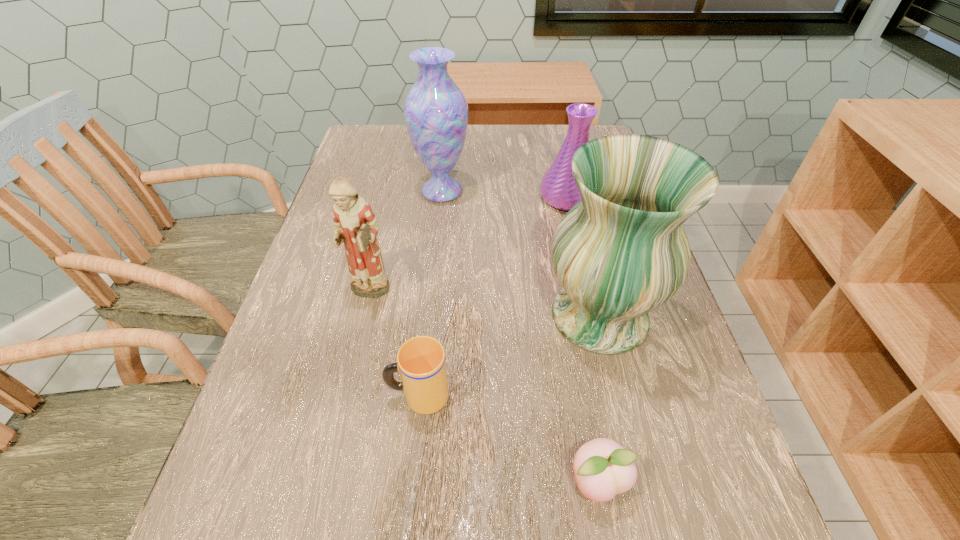
Find the location of `vacant area at the far left corner of the desktop`. vacant area at the far left corner of the desktop is located at coordinates (352, 160).

The width and height of the screenshot is (960, 540). I want to click on vacant point located between the second nearest object and the figurine, so click(394, 345).

Where is `vacant area that lies between the second shortest object and the nearest object`? This screenshot has width=960, height=540. vacant area that lies between the second shortest object and the nearest object is located at coordinates (508, 439).

Identify the location of free space between the nearest vase and the cup. The width and height of the screenshot is (960, 540). (509, 356).

I want to click on vacant region between the figurine and the shortest vase, so click(x=468, y=246).

This screenshot has width=960, height=540. Identify the location of free space between the leftmost object and the leftmost vase. (405, 242).

Identify the location of vacant region between the fifth tallest object and the nearest vase. This screenshot has width=960, height=540. (509, 356).

Where is `vacant area that lies between the fifth farthest object and the leftmost vase`? vacant area that lies between the fifth farthest object and the leftmost vase is located at coordinates (430, 293).

Where is `free space between the cup and the nearest vase`? The image size is (960, 540). free space between the cup and the nearest vase is located at coordinates (509, 356).

Where is `empty space between the figurine and the leftmost vase`? The image size is (960, 540). empty space between the figurine and the leftmost vase is located at coordinates (405, 242).